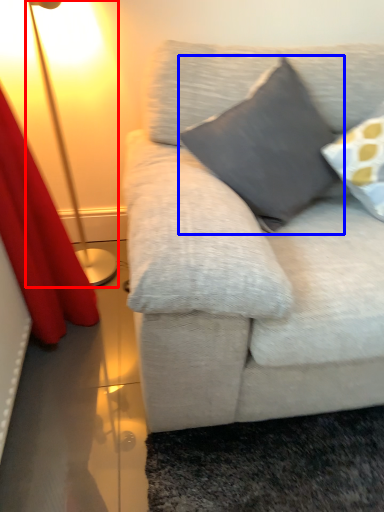
Question: Which object appears closest to the camera in this image, lamp (highlighted by a red box) or pillow (highlighted by a blue box)?

Choices:
 (A) lamp
 (B) pillow

Answer: (B)